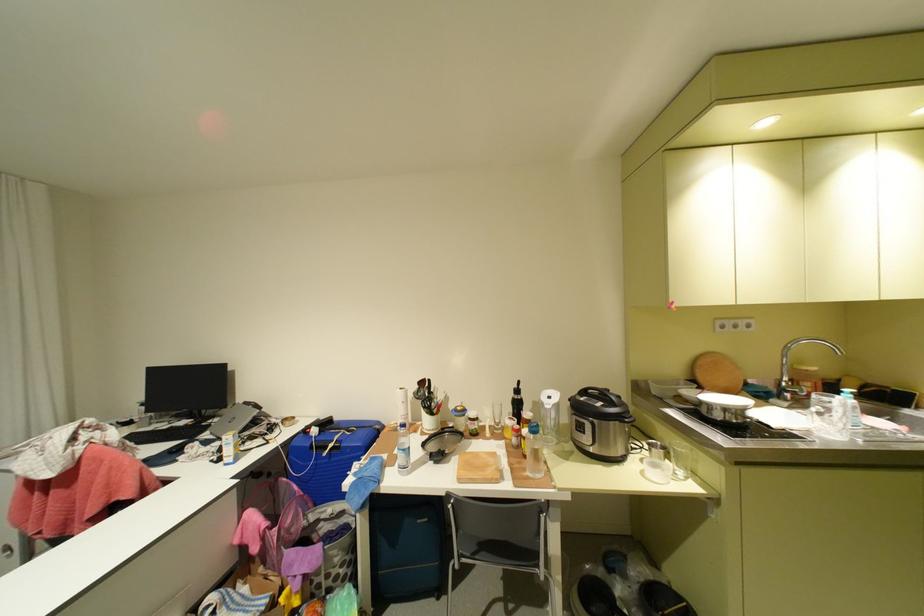
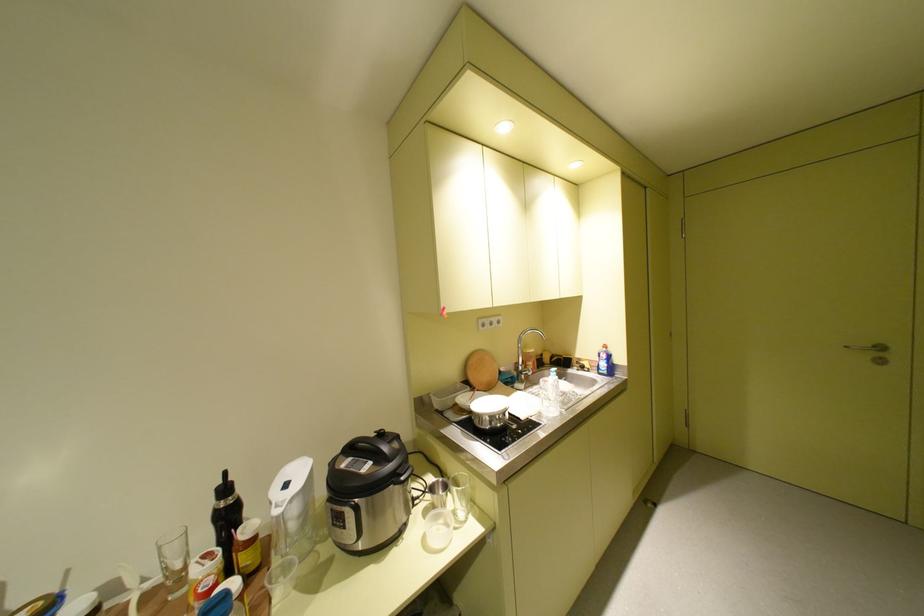
Question: I am providing you with two images of the same scene from different viewpoints. Please identify which objects are invisible in image2.

Choices:
 (A) clear water bottle
 (B) blue soap bottle
 (C) round cutting board
 (D) none of these

Answer: (D)